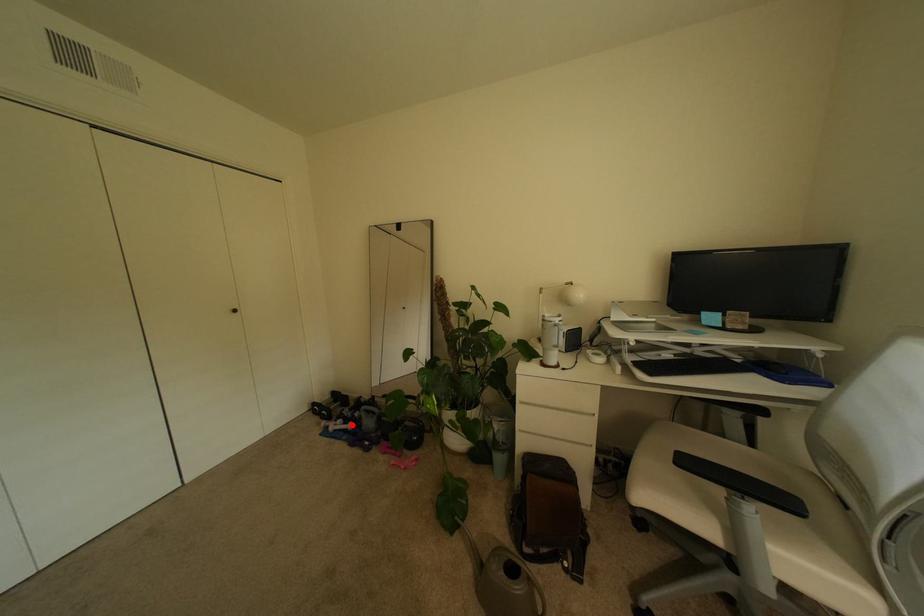
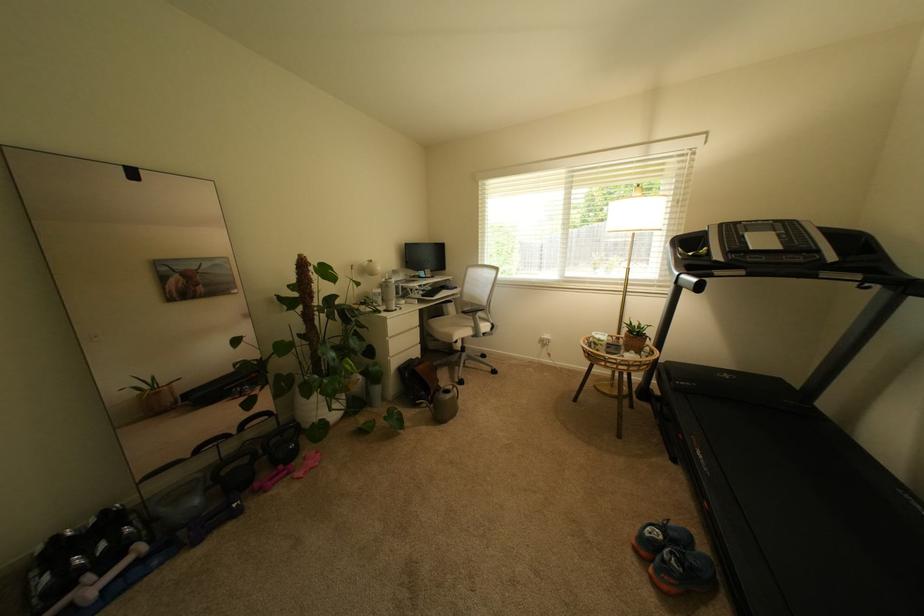
Question: I am providing you with two images of the same scene from different viewpoints. Given a red point in image1, look at the same physical point in image2. Is it:

Choices:
 (A) Closer to the viewpoint
 (B) Farther from the viewpoint

Answer: (A)